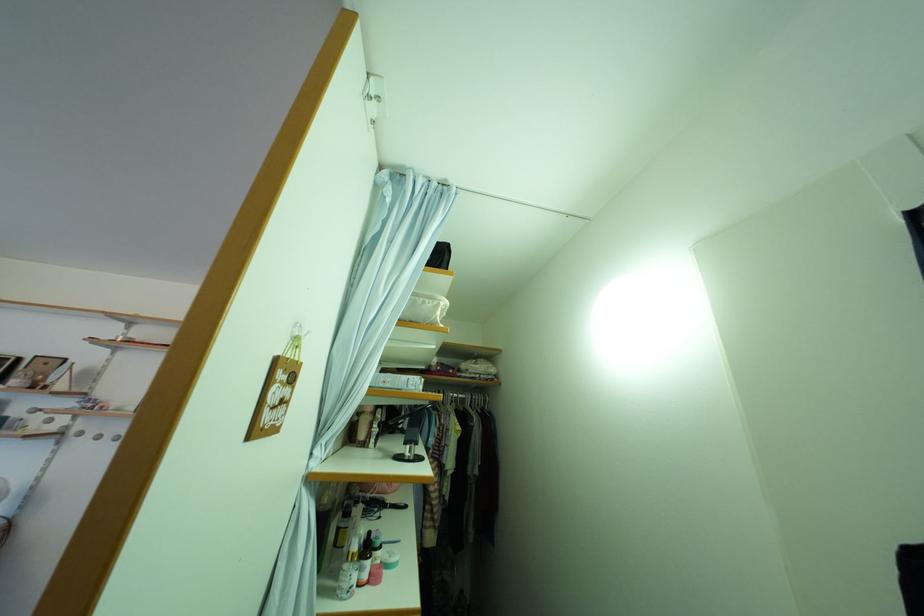
Where would you lift the black desk lamp? Please return your answer as a coordinate pair (x, y).

(411, 437)